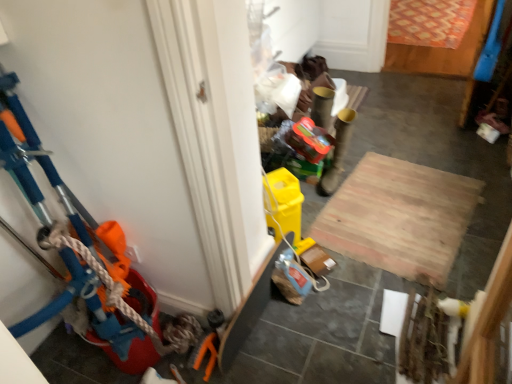
Identify the location of vacant region below wooden at center (from a real-world perspective). (395, 212).